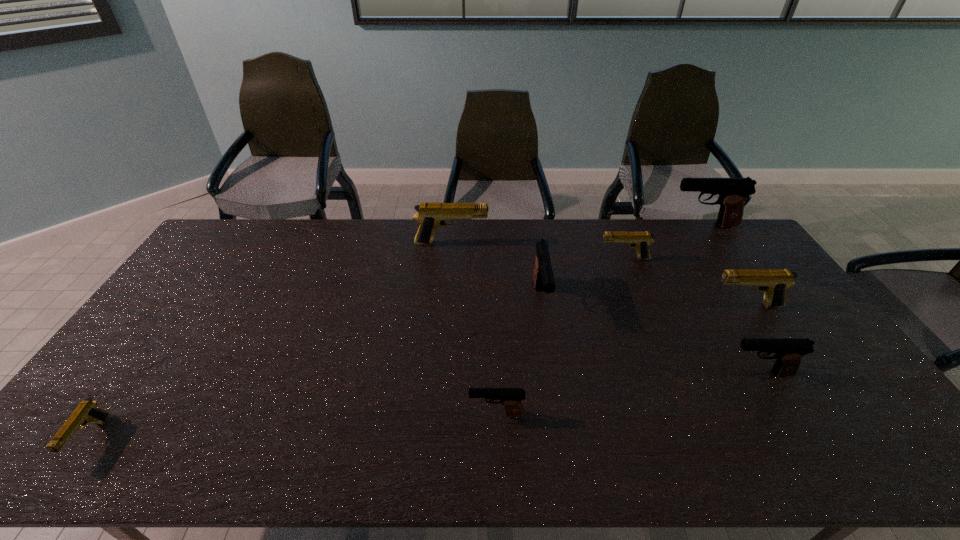
You are a GUI agent. You are given a task and a screenshot of the screen. Output one action in this format:
    pyautogui.click(x=<x>, y=<y>)
    Task: Click on the free space located 0.390m at the barrel of the smallest black pistol
    This screenshot has width=960, height=540.
    Given the screenshot: What is the action you would take?
    pyautogui.click(x=312, y=414)

The height and width of the screenshot is (540, 960). I want to click on vacant area located 0.120m at the barrel of the smallest black pistol, so click(x=420, y=414).

This screenshot has width=960, height=540. Identify the location of free space located at the barrel of the smallest black pistol. (429, 414).

Where is `object present at the near edge`? object present at the near edge is located at coordinates (87, 411).

Where is `object located in the left edge section of the desktop`? object located in the left edge section of the desktop is located at coordinates (87, 411).

You are a GUI agent. You are given a task and a screenshot of the screen. Output one action in this format:
    pyautogui.click(x=<x>, y=<y>)
    Task: Click on the object that is positioned at the near left corner
    Image resolution: width=960 pixels, height=540 pixels.
    Given the screenshot: What is the action you would take?
    pyautogui.click(x=87, y=411)

I want to click on object positioned at the far right corner, so click(x=732, y=192).

Where is `vacant area at the far edge`? vacant area at the far edge is located at coordinates (388, 249).

At what (x,y) coordinates should I click in order to perform the action: click on free space at the near edge of the desktop. Please return your answer as a coordinate pair (x, y). This screenshot has width=960, height=540. Looking at the image, I should click on point(184,444).

In the image, there is a desktop. At what (x,y) coordinates should I click in order to perform the action: click on blank space at the left edge. Please return your answer as a coordinate pair (x, y). Looking at the image, I should click on (87, 424).